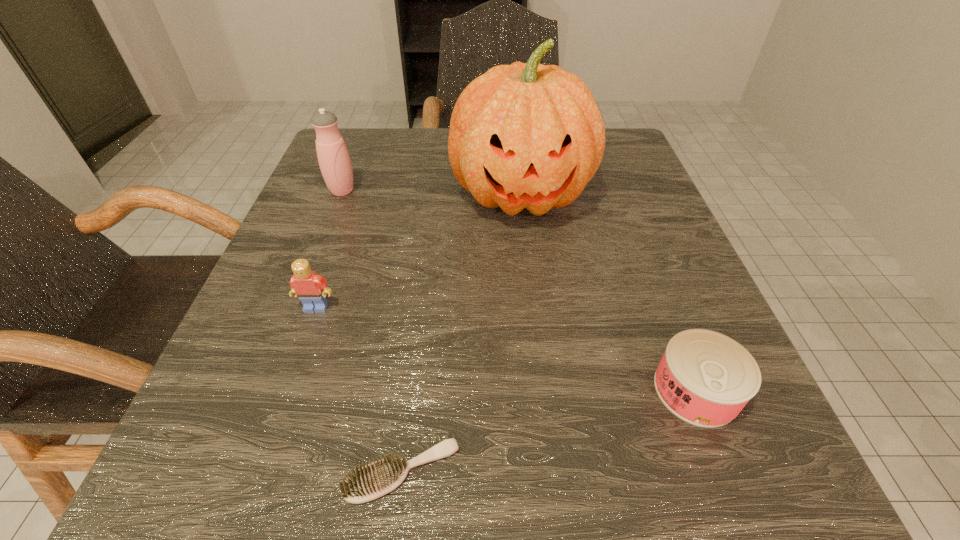
Where is `free spot located 0.070m on the front-facing side of the third shortest object`? free spot located 0.070m on the front-facing side of the third shortest object is located at coordinates (300, 354).

This screenshot has width=960, height=540. Find the location of `vacant space located 0.080m on the back of the can`. vacant space located 0.080m on the back of the can is located at coordinates (665, 310).

This screenshot has height=540, width=960. Identify the location of vacant space located 0.210m on the right of the shortest object. (651, 471).

The width and height of the screenshot is (960, 540). I want to click on pumpkin that is at the far edge, so click(526, 135).

At what (x,y) coordinates should I click in order to perform the action: click on thermos bottle that is positioned at the far edge. Please return your answer as a coordinate pair (x, y). Looking at the image, I should click on (333, 157).

Locate an element on the screen. This screenshot has height=540, width=960. object that is positioned at the near edge is located at coordinates (380, 477).

This screenshot has height=540, width=960. Find the location of `thermos bottle that is at the left edge`. thermos bottle that is at the left edge is located at coordinates (333, 157).

Identify the location of Lego that is at the left edge. (311, 289).

I want to click on pumpkin that is at the right edge, so click(x=526, y=135).

Where is `can that is at the right edge`? can that is at the right edge is located at coordinates (705, 378).